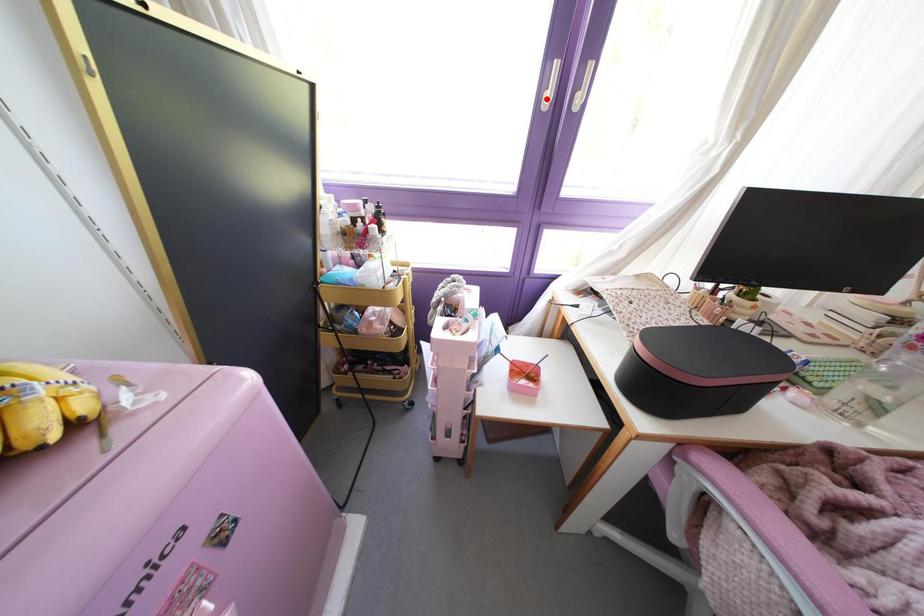
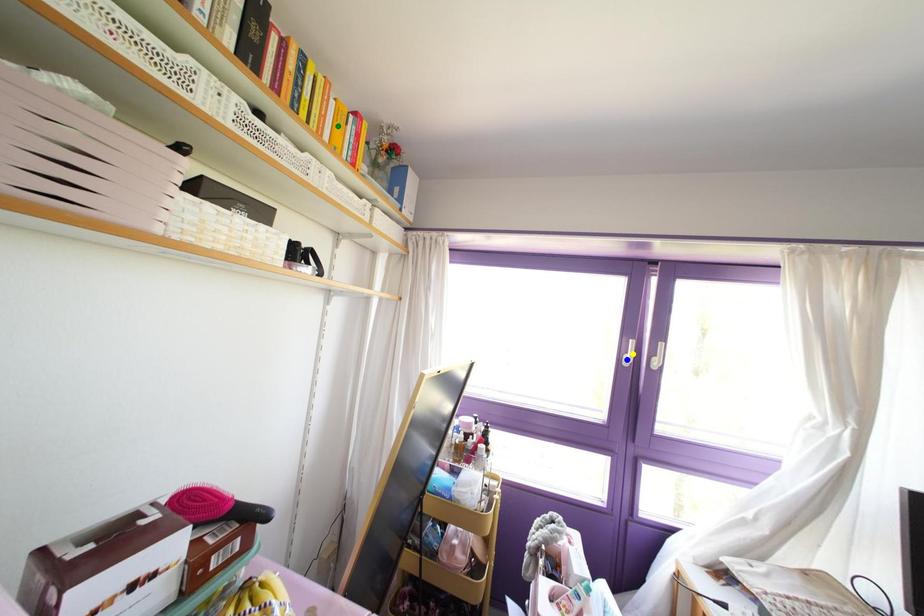
Question: I am providing you with two images of the same scene from different viewpoints. A red point is marked on the first image. You are given multiple points on the second image. Which mark in image 2 goes with the point in image 1?

Choices:
 (A) green point
 (B) blue point
 (C) yellow point

Answer: (B)